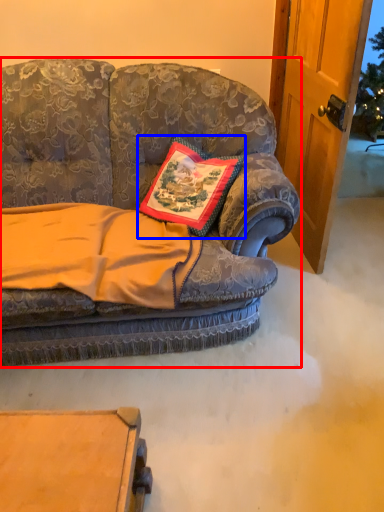
Question: Which object is closer to the camera taking this photo, studio couch (highlighted by a red box) or pillow (highlighted by a blue box)?

Choices:
 (A) studio couch
 (B) pillow

Answer: (A)